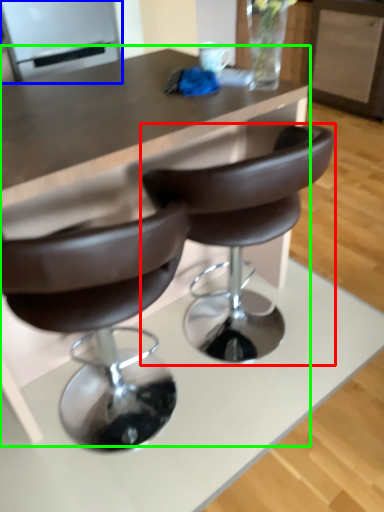
Question: Which object is positioned farthest from chair (highlighted by a red box)? Select from appliance (highlighted by a blue box) and table (highlighted by a green box).

Choices:
 (A) appliance
 (B) table

Answer: (A)